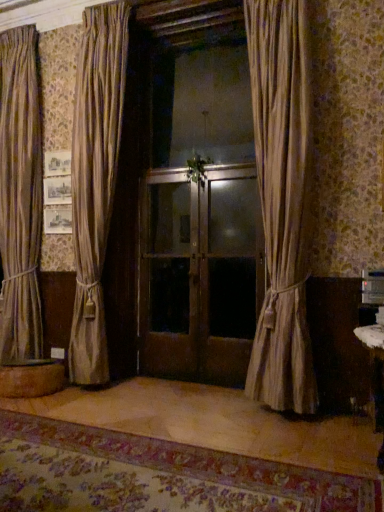
Locate an element on the screen. This screenshot has height=512, width=384. vacant area located to the right-hand side of wooden round table at lower left is located at coordinates (91, 393).